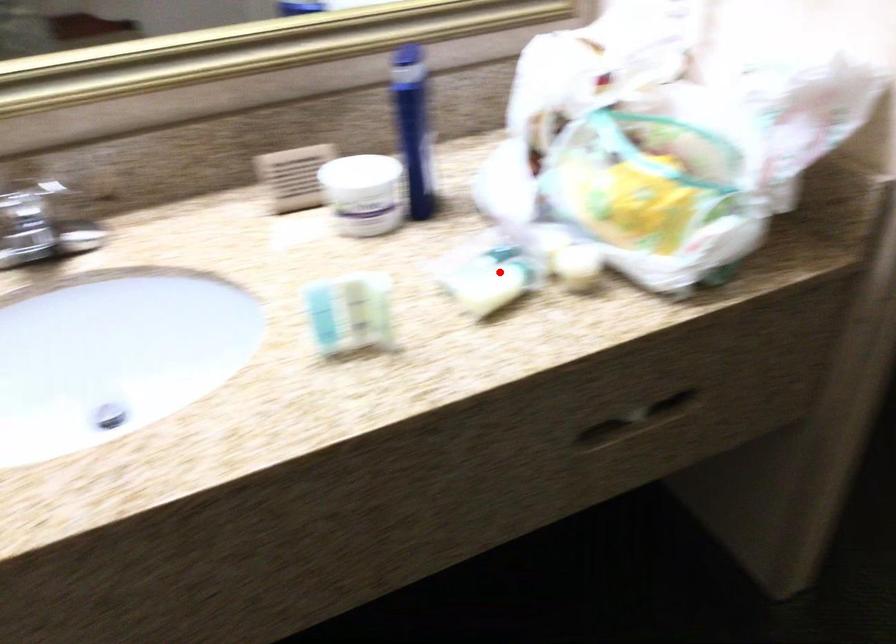
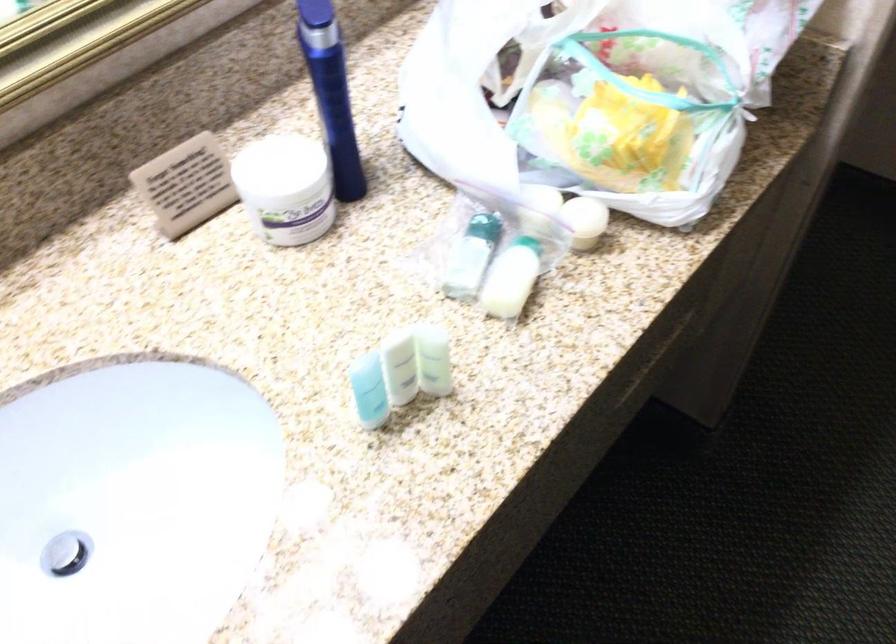
In the second image, find the point that corresponds to the highlighted location in the first image.

(518, 261)